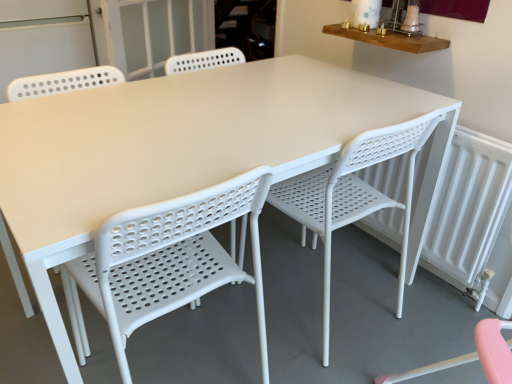
Question: Is transparent glass screen door at upper center, the first screen door from the right, turned away from white plastic radiator at right?

Choices:
 (A) yes
 (B) no

Answer: (B)

Question: Considering the relative positions of transparent glass screen door at upper center, marked as the 2th screen door in a left-to-right arrangement, and white plastic radiator at right in the image provided, is transparent glass screen door at upper center, marked as the 2th screen door in a left-to-right arrangement, to the left of white plastic radiator at right from the viewer's perspective?

Choices:
 (A) no
 (B) yes

Answer: (B)

Question: Is white plastic radiator at right located within transparent glass screen door at upper center, marked as the 2th screen door in a left-to-right arrangement?

Choices:
 (A) yes
 (B) no

Answer: (B)

Question: From a real-world perspective, is transparent glass screen door at upper center, the first screen door from the right, beneath white plastic radiator at right?

Choices:
 (A) yes
 (B) no

Answer: (B)

Question: Can you confirm if transparent glass screen door at upper center, the first screen door from the right, is positioned to the right of white plastic radiator at right?

Choices:
 (A) yes
 (B) no

Answer: (B)

Question: From the image's perspective, is transparent glass screen door at upper center, marked as the 2th screen door in a left-to-right arrangement, over white plastic radiator at right?

Choices:
 (A) no
 (B) yes

Answer: (B)

Question: From the image's perspective, is white perforated screen door at upper left, placed as the first screen door when sorted from left to right, located beneath transparent glass screen door at upper center, the first screen door from the right?

Choices:
 (A) yes
 (B) no

Answer: (A)

Question: Considering the relative positions of white perforated screen door at upper left, placed as the first screen door when sorted from left to right, and transparent glass screen door at upper center, the first screen door from the right, in the image provided, is white perforated screen door at upper left, placed as the first screen door when sorted from left to right, to the right of transparent glass screen door at upper center, the first screen door from the right, from the viewer's perspective?

Choices:
 (A) yes
 (B) no

Answer: (B)

Question: Does white perforated screen door at upper left, placed as the first screen door when sorted from left to right, have a lesser height compared to transparent glass screen door at upper center, the first screen door from the right?

Choices:
 (A) no
 (B) yes

Answer: (A)

Question: From a real-world perspective, is white perforated screen door at upper left, placed as the first screen door when sorted from left to right, located beneath transparent glass screen door at upper center, the first screen door from the right?

Choices:
 (A) yes
 (B) no

Answer: (A)

Question: Would you say transparent glass screen door at upper center, the first screen door from the right, is part of white perforated screen door at upper left, the second screen door in the right-to-left sequence,'s contents?

Choices:
 (A) yes
 (B) no

Answer: (B)

Question: Does white perforated screen door at upper left, the second screen door in the right-to-left sequence, have a lesser width compared to transparent glass screen door at upper center, marked as the 2th screen door in a left-to-right arrangement?

Choices:
 (A) no
 (B) yes

Answer: (A)

Question: Can you confirm if white perforated plastic chair at center, arranged as the 2th chair when viewed from the right, is wider than transparent glass screen door at upper center, the first screen door from the right?

Choices:
 (A) yes
 (B) no

Answer: (A)